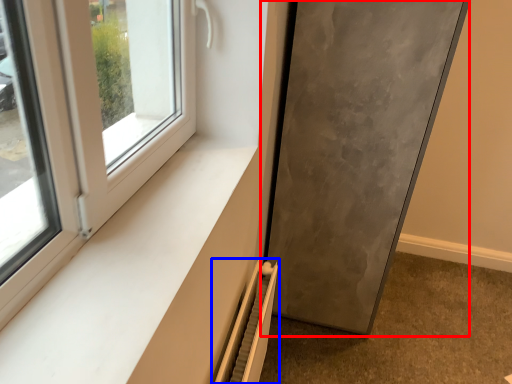
Question: Which object is further to the camera taking this photo, door (highlighted by a red box) or radiator (highlighted by a blue box)?

Choices:
 (A) door
 (B) radiator

Answer: (A)